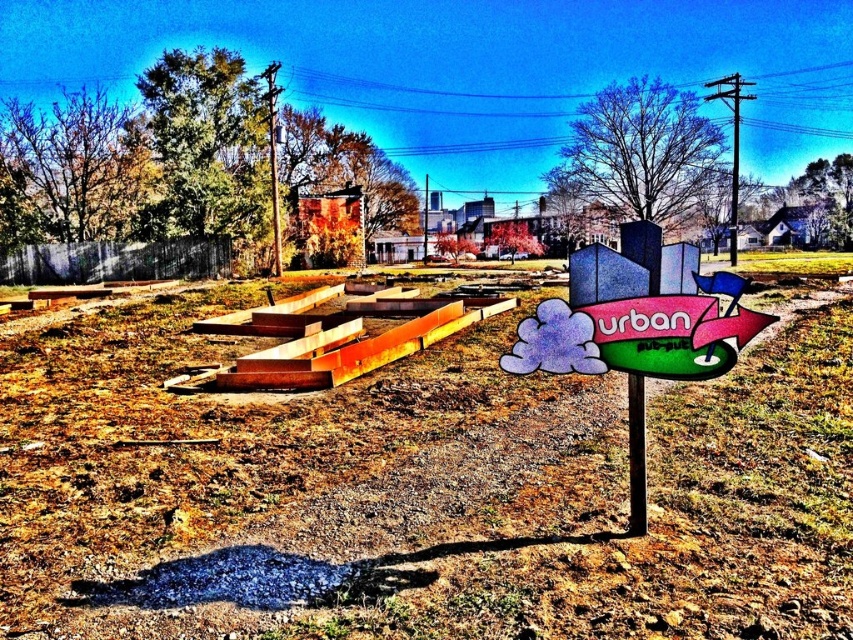
Does metallic pole at upper right have a greater height compared to metallic pole at upper center?

Yes.

Does point (735, 259) come behind point (733, 163)?

No, it is in front of (733, 163).

Does point (735, 221) come farther from viewer compared to point (735, 227)?

Yes, it is.

Locate an element on the screen. metallic pole at upper right is located at coordinates (732, 144).

Locate an element on the screen. The height and width of the screenshot is (640, 853). wooden boards at center is located at coordinates (416, 492).

Does wooden boards at center appear under metallic pole at center?

Correct, wooden boards at center is located below metallic pole at center.

Is point (482, 593) behind point (424, 257)?

That is False.

Identify the location of wooden boards at center. pos(416,492).

Which of these two, metallic pole at upper right or metallic pole at center, stands shorter?

Standing shorter between the two is metallic pole at center.

Does metallic pole at upper right lie behind metallic pole at center?

No, it is not.

Does point (718, 77) come in front of point (422, 246)?

No.

The height and width of the screenshot is (640, 853). In order to click on metallic pole at upper right in this screenshot , I will do `click(732, 144)`.